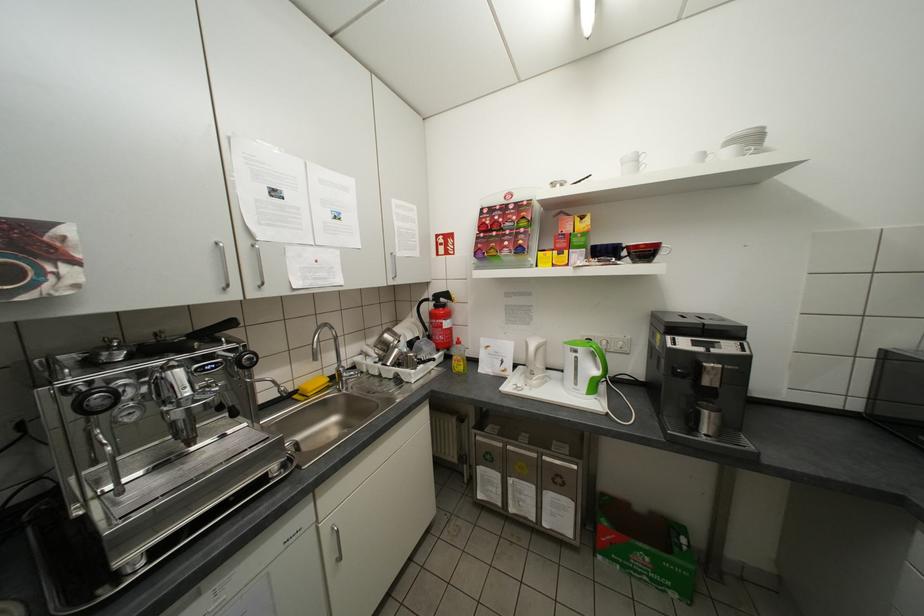
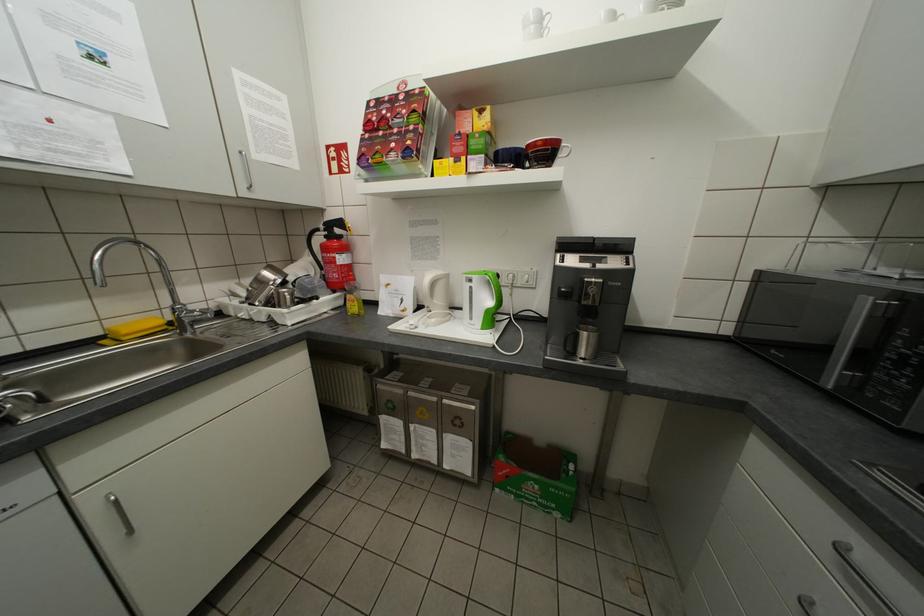
In the second image, find the point that corresponds to (421,323) in the first image.

(319, 262)